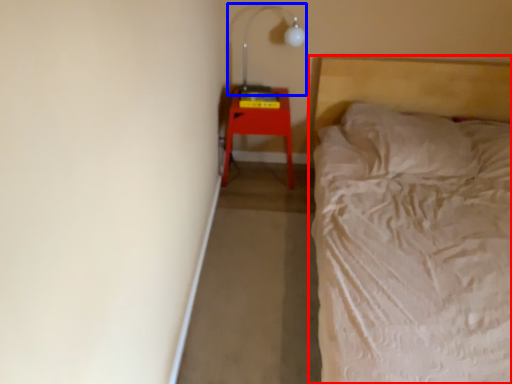
Question: Which object is closer to the camera taking this photo, bed (highlighted by a red box) or lamp (highlighted by a blue box)?

Choices:
 (A) bed
 (B) lamp

Answer: (A)